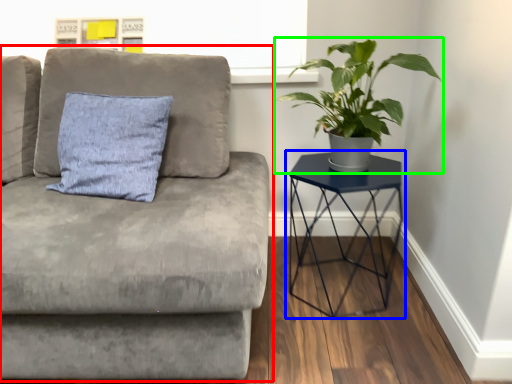
Question: Considering the real-world distances, which object is farthest from studio couch (highlighted by a red box)? table (highlighted by a blue box) or houseplant (highlighted by a green box)?

Choices:
 (A) table
 (B) houseplant

Answer: (B)